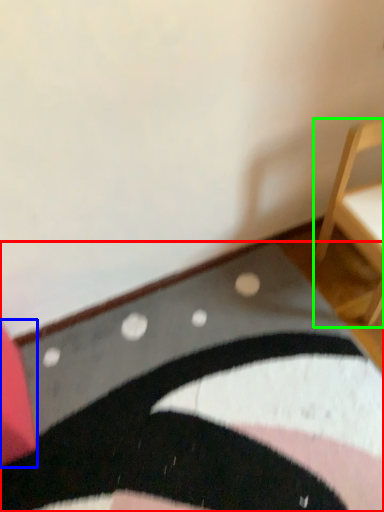
Question: Which object is positioned farthest from mat (highlighted by a red box)? Select from furniture (highlighted by a blue box) and furniture (highlighted by a green box).

Choices:
 (A) furniture
 (B) furniture

Answer: (B)